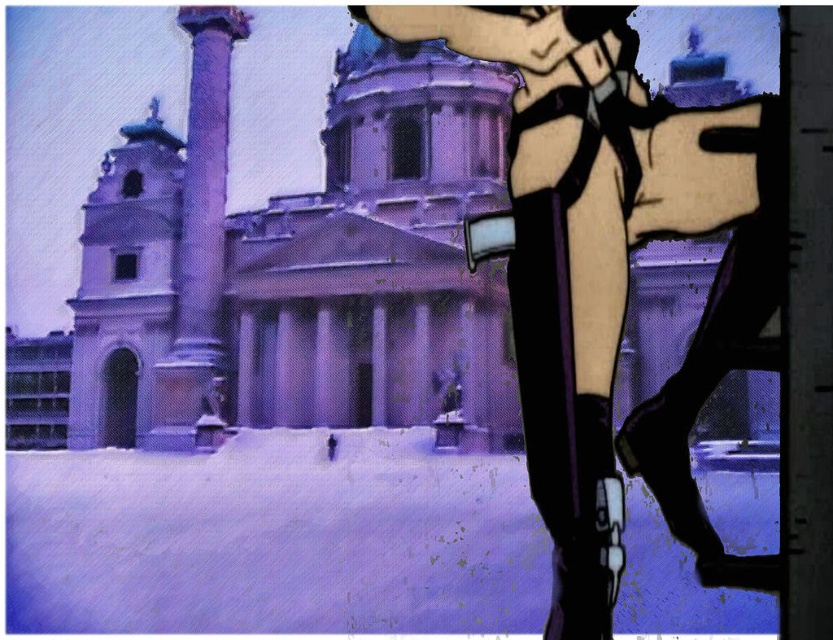
Question: Can you confirm if smooth beige shorts at right is wider than smooth stone column at center-left?

Choices:
 (A) no
 (B) yes

Answer: (B)

Question: Which object appears farthest from the camera in this image?

Choices:
 (A) smooth stone column at center-left
 (B) smooth beige shorts at right

Answer: (A)

Question: Is smooth beige shorts at right bigger than smooth stone column at center-left?

Choices:
 (A) yes
 (B) no

Answer: (B)

Question: Is smooth beige shorts at right positioned behind smooth stone column at center-left?

Choices:
 (A) yes
 (B) no

Answer: (B)